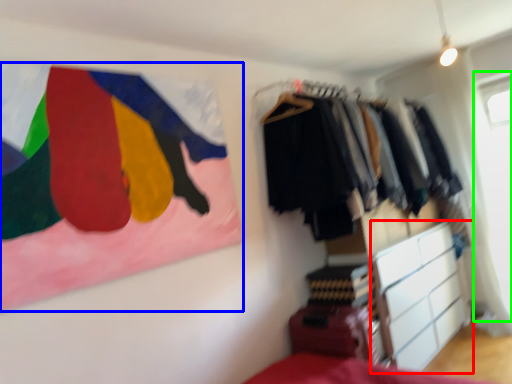
Question: Which object is the farthest from chest of drawers (highlighted by a red box)? Choose among these: flag (highlighted by a blue box) or window screen (highlighted by a green box).

Choices:
 (A) flag
 (B) window screen

Answer: (A)